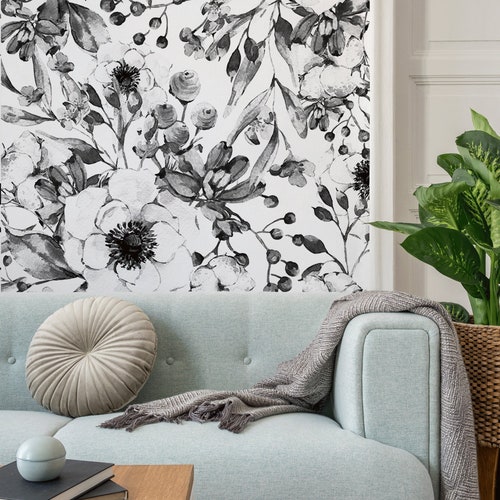
Find the location of a particular element. round pillw is located at coordinates (65, 331).